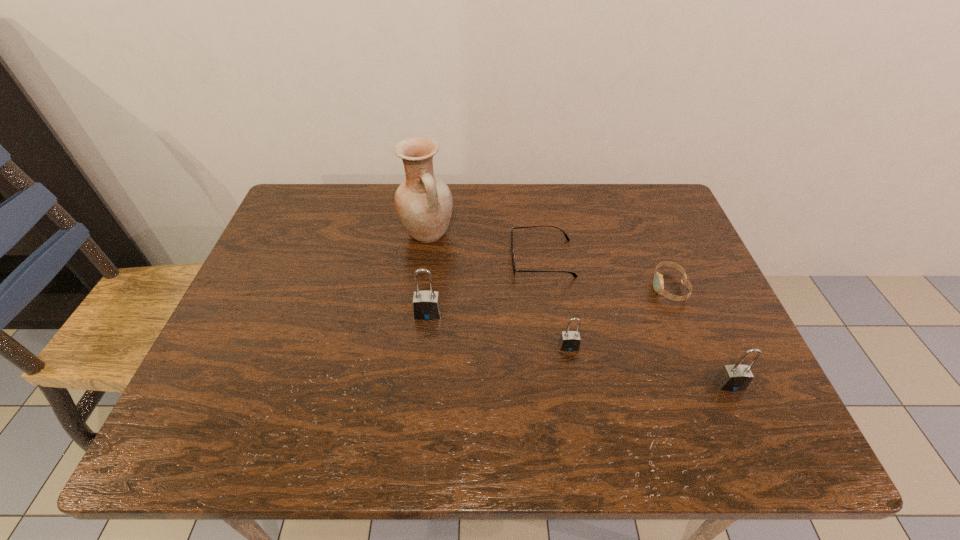
This screenshot has width=960, height=540. Find the location of `free spot located 0.090m on the shackle of the second nearest padlock`. free spot located 0.090m on the shackle of the second nearest padlock is located at coordinates (576, 388).

Locate an element on the screen. free spot located on the front of the pottery is located at coordinates (422, 272).

At what (x,y) coordinates should I click in order to perform the action: click on blank space located 0.380m on the face of the second shortest object. Please return your answer as a coordinate pair (x, y). Image resolution: width=960 pixels, height=540 pixels. Looking at the image, I should click on (502, 287).

You are a GUI agent. You are given a task and a screenshot of the screen. Output one action in this format:
    pyautogui.click(x=<x>, y=<y>)
    Task: Click on the vacant space located 0.140m on the face of the second shortest object
    This screenshot has height=540, width=960.
    Given the screenshot: What is the action you would take?
    pyautogui.click(x=597, y=287)

Locate an element on the screen. The image size is (960, 540). vacant space positioned 0.320m on the face of the second shortest object is located at coordinates (526, 287).

Where is `blank space located on the front-facing side of the spectacles`? blank space located on the front-facing side of the spectacles is located at coordinates (369, 258).

What are the coordinates of `vacant position located on the front-facing side of the spectacles` in the screenshot? It's located at (365, 258).

This screenshot has width=960, height=540. I want to click on blank space located on the front-facing side of the spectacles, so click(398, 258).

Locate an element on the screen. This screenshot has width=960, height=540. object present at the far edge is located at coordinates (424, 203).

You are a GUI agent. You are given a task and a screenshot of the screen. Output one action in this format:
    pyautogui.click(x=<x>, y=<y>)
    Task: Click on the object positioned at the near edge
    Image resolution: width=960 pixels, height=540 pixels.
    Given the screenshot: What is the action you would take?
    pyautogui.click(x=737, y=377)